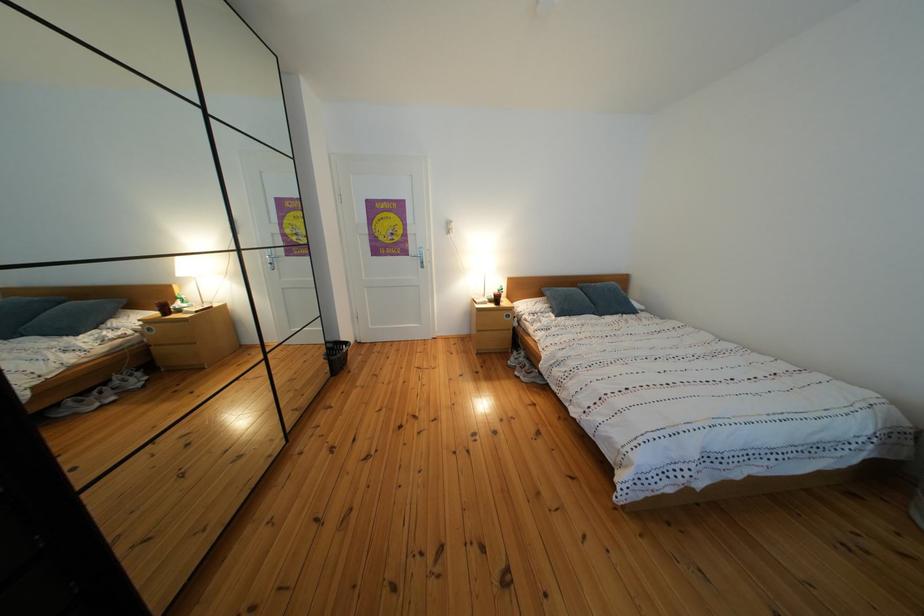
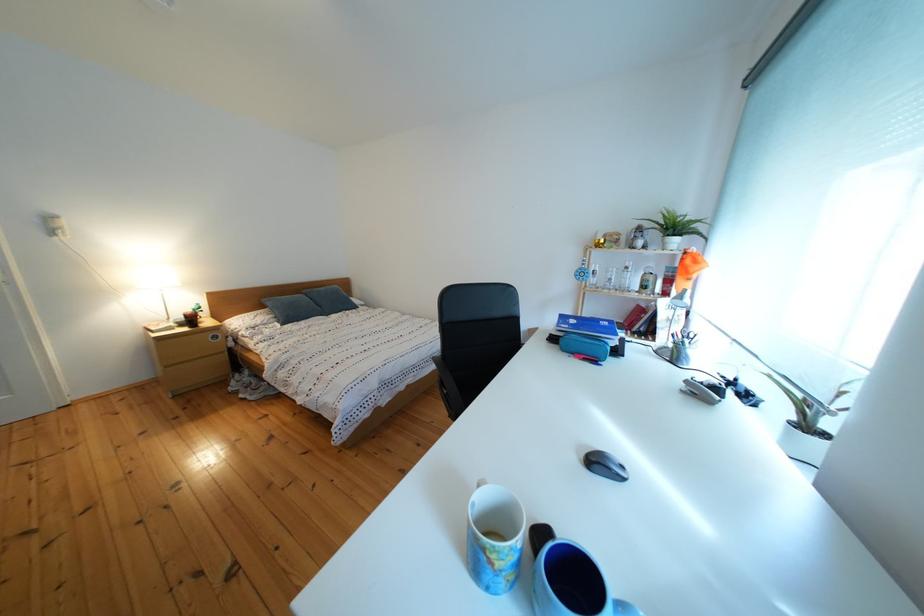
Question: Based on the continuous images, in which direction is the camera rotating? Reply with the corresponding letter.

Choices:
 (A) Left
 (B) Right
 (C) Up
 (D) Down

Answer: (B)